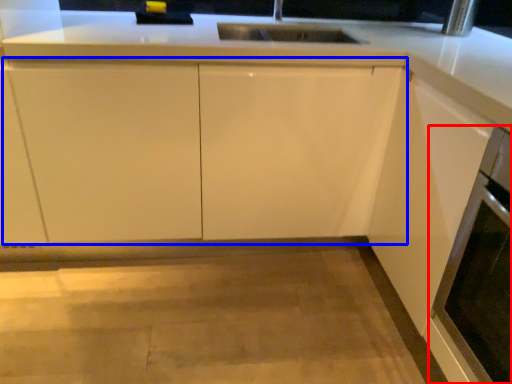
Question: Which object appears closest to the camera in this image, oven (highlighted by a red box) or cabinetry (highlighted by a blue box)?

Choices:
 (A) oven
 (B) cabinetry

Answer: (A)